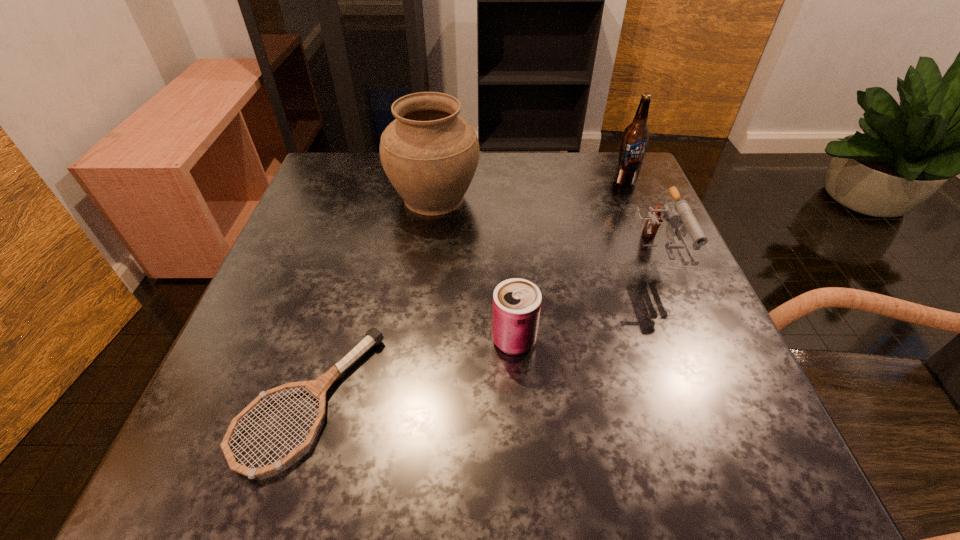
This screenshot has height=540, width=960. I want to click on free space located on the left of the fourth tallest object, so click(385, 340).

Find the location of a particular element. Image resolution: width=960 pixels, height=540 pixels. vacant space located 0.380m on the back of the shortest object is located at coordinates (370, 204).

Identify the location of urn that is at the far edge. (430, 154).

Where is `beer bottle positioned at the far edge`? This screenshot has width=960, height=540. beer bottle positioned at the far edge is located at coordinates (636, 135).

Find the location of `object situated at the near edge`. object situated at the near edge is located at coordinates (318, 387).

Find the location of a particular element. The width and height of the screenshot is (960, 540). object situated at the left edge is located at coordinates (318, 387).

I want to click on beer bottle located in the right edge section of the desktop, so (636, 135).

Locate an element on the screen. gun present at the right edge is located at coordinates (672, 214).

Identify the location of object situated at the near left corner. The image size is (960, 540). (318, 387).

Where is `object located in the far right corner section of the desktop`? Image resolution: width=960 pixels, height=540 pixels. object located in the far right corner section of the desktop is located at coordinates (636, 135).